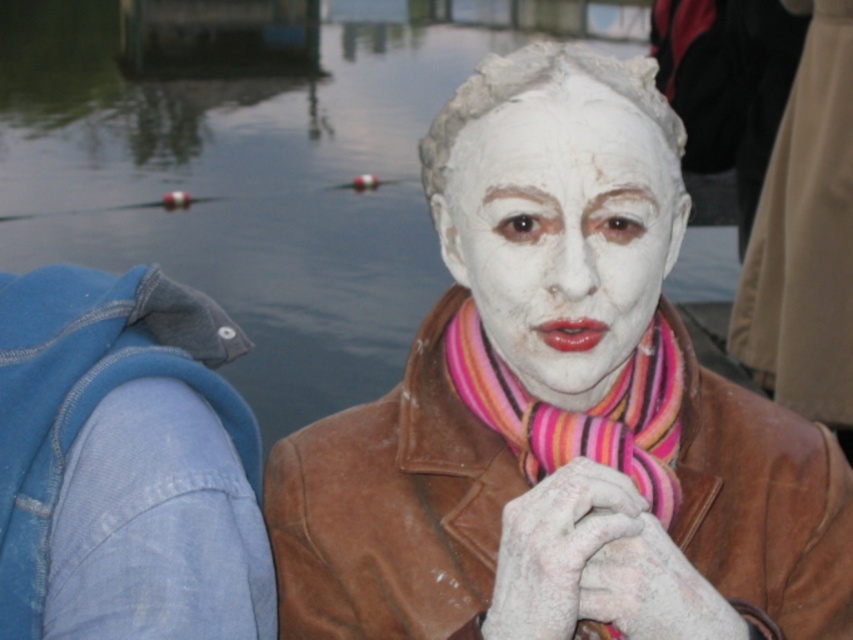
Locate an element on the screen. The width and height of the screenshot is (853, 640). glossy water at center is located at coordinates (241, 188).

Which of these two, glossy water at center or white matte face at center, stands shorter?

white matte face at center

Between point (115, 262) and point (618, 132), which one is positioned in front?

Point (618, 132)

Where is `glossy water at center`? This screenshot has height=640, width=853. glossy water at center is located at coordinates (241, 188).

Is glossy water at center taller than denim jacket at left?

Yes.

The image size is (853, 640). What do you see at coordinates (241, 188) in the screenshot?
I see `glossy water at center` at bounding box center [241, 188].

Identify the location of glossy water at center. (x=241, y=188).

From the picture: Does denim jacket at left have a lesser width compared to striped wool scarf at center?

No.

Does denim jacket at left come in front of striped wool scarf at center?

No, it is behind striped wool scarf at center.

At what (x,y) coordinates should I click in order to perform the action: click on denim jacket at left. Please return your answer as a coordinate pair (x, y). Looking at the image, I should click on (86, 392).